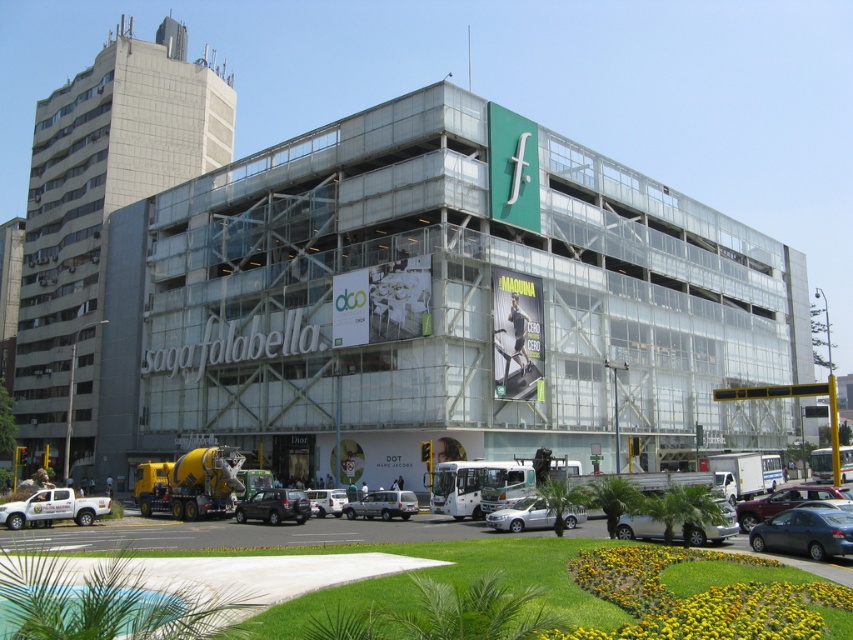
Based on the photo, you are standing in front of the modern commercial building and want to locate two specific points marked on the facade. The first point is at coordinates point (59, 449) and the second is at point (811, 532). Which of these two points is closer to you?

Point (59, 449) is closer to you because it is further to the viewer than point (811, 532).